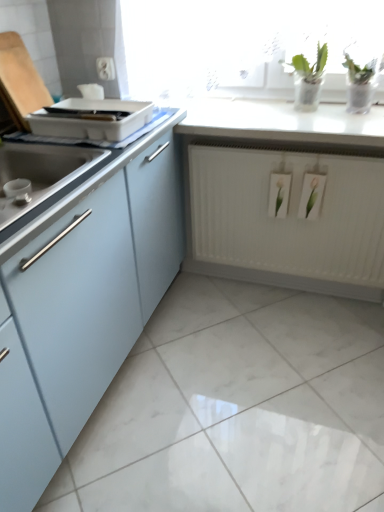
Question: Considering the positions of point [x=289, y=102] and point [x=246, y=247], is point [x=289, y=102] closer or farther from the camera than point [x=246, y=247]?

Choices:
 (A) farther
 (B) closer

Answer: (B)

Question: From a real-world perspective, is white glossy countertop at upper center positioned above or below white matte radiator at center?

Choices:
 (A) below
 (B) above

Answer: (B)

Question: Which object is the closest to the white glossy countertop at upper center?

Choices:
 (A) matte light blue cabinet at left
 (B) white plastic electric outlet at upper center
 (C) white plastic tray at upper left
 (D) white matte radiator at center

Answer: (D)

Question: Estimate the real-world distances between objects in this image. Which object is closer to the white plastic tray at upper left?

Choices:
 (A) white matte radiator at center
 (B) white glossy countertop at upper center
 (C) white plastic electric outlet at upper center
 (D) matte light blue cabinet at left

Answer: (C)